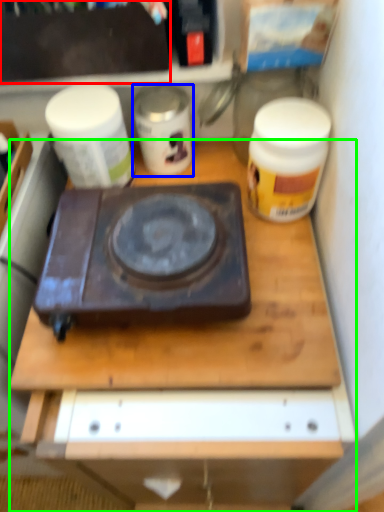
Question: Which object is positioned closest to box (highlighted by a red box)? Select from yoghurt (highlighted by a blue box) and desk (highlighted by a green box).

Choices:
 (A) yoghurt
 (B) desk

Answer: (A)